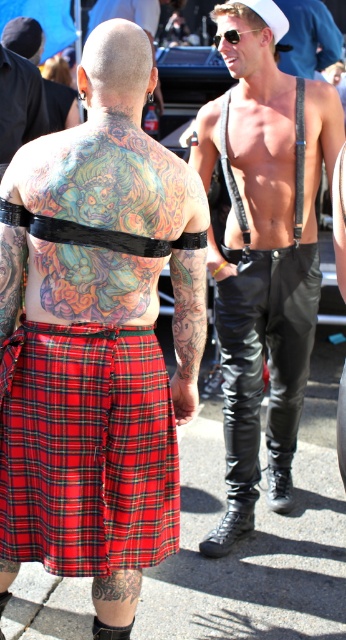
Who is positioned more to the left, shiny leather pants at right or shiny black leather pants at center?

Positioned to the left is shiny leather pants at right.

Identify the location of shiny leather pants at right. The height and width of the screenshot is (640, 346). (104, 291).

Who is more forward, (259, 227) or (104, 577)?

Point (104, 577) is in front.

Is shiny black leather pants at center shorter than dark brown leather belt at lower center?

Incorrect, shiny black leather pants at center's height does not fall short of dark brown leather belt at lower center's.

Measure the distance between point (246, 173) and camera.

Point (246, 173) and camera are 4.27 meters apart.

This screenshot has height=640, width=346. In order to click on shiny black leather pants at center in this screenshot , I will do `click(262, 250)`.

Between point (285, 225) and point (111, 564), which one is positioned in front?

Point (111, 564) is in front.

Describe the element at coordinates (262, 250) in the screenshot. I see `shiny black leather pants at center` at that location.

Identify the location of shiny black leather pants at center. (262, 250).